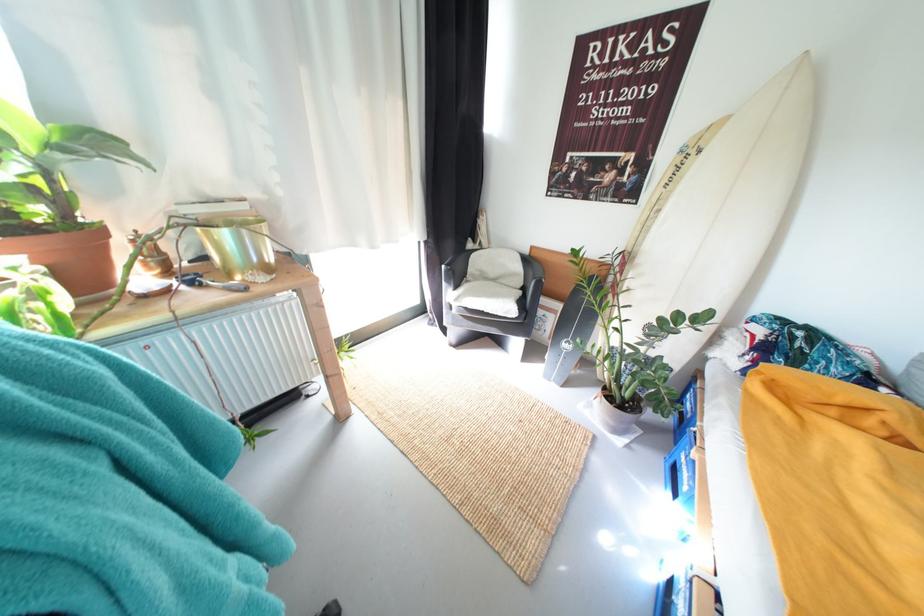
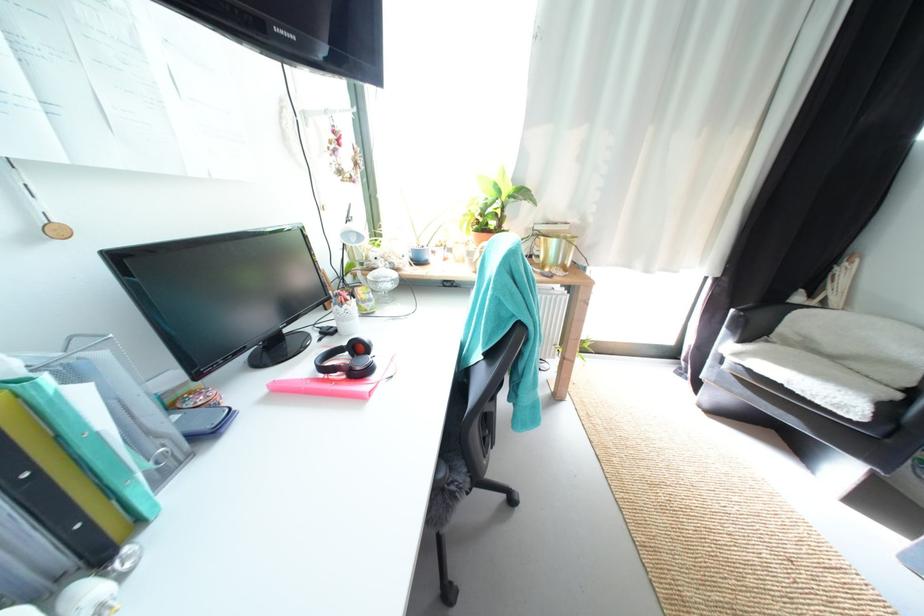
Where in the second image is the point corresponding to (x=233, y=236) from the first image?

(562, 244)